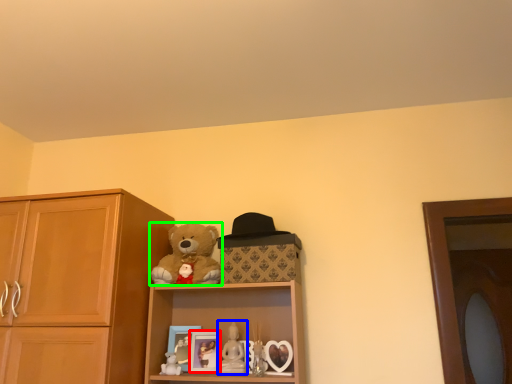
Question: Which object is positioned closest to picture frame (highlighted by a red box)? Select from figurine (highlighted by a blue box) and teddy bear (highlighted by a green box).

Choices:
 (A) figurine
 (B) teddy bear

Answer: (A)